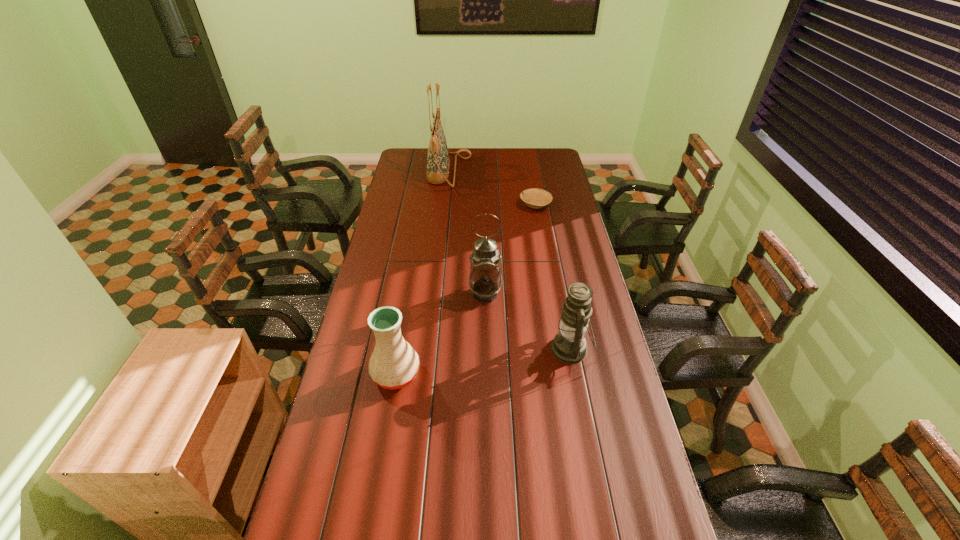
Locate an element on the screen. the farthest object is located at coordinates (438, 163).

You are a GUI agent. You are given a task and a screenshot of the screen. Output one action in this format:
    pyautogui.click(x=<x>, y=<y>)
    Task: Click on the handbag
    
    Given the screenshot: What is the action you would take?
    pyautogui.click(x=438, y=163)

The height and width of the screenshot is (540, 960). I want to click on the third farthest object, so click(485, 280).

The width and height of the screenshot is (960, 540). In order to click on the second tallest object in this screenshot , I will do pyautogui.click(x=485, y=280).

Identify the location of the shorter oil lamp. (569, 346).

Find the location of a particular element. The width and height of the screenshot is (960, 540). the nearer oil lamp is located at coordinates (569, 346).

You are a GUI agent. You are given a task and a screenshot of the screen. Output one action in this format:
    pyautogui.click(x=<x>, y=<y>)
    Task: Click on the pottery
    The height and width of the screenshot is (540, 960).
    Given the screenshot: What is the action you would take?
    pyautogui.click(x=394, y=364)

Identify the location of the second farthest object. This screenshot has width=960, height=540. (535, 198).

The image size is (960, 540). In order to click on bowl in this screenshot , I will do `click(535, 198)`.

At what (x,y) coordinates should I click in order to perform the action: click on vacant space situated on the front-facing side of the farthest object. Please return your answer as a coordinate pair (x, y). The height and width of the screenshot is (540, 960). Looking at the image, I should click on (537, 171).